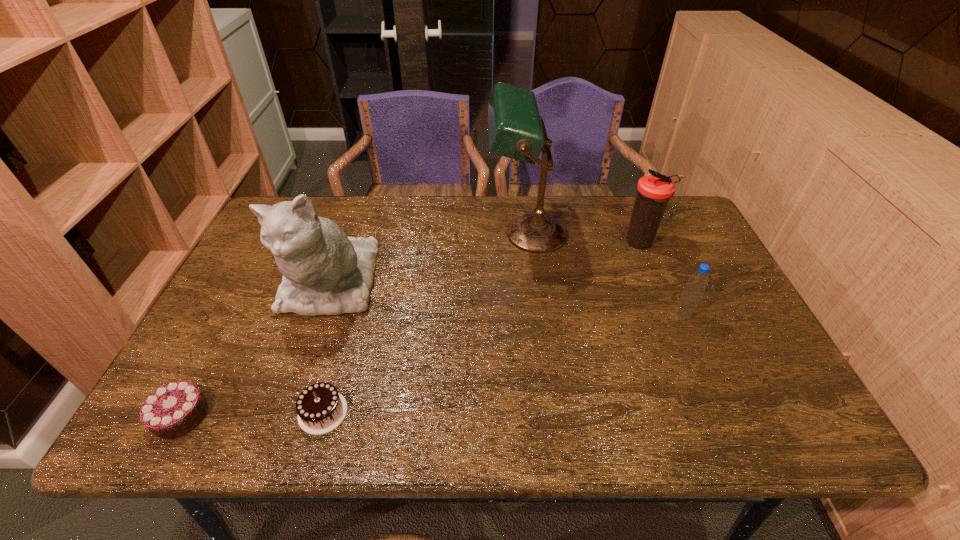
I want to click on free region located 0.060m on the front-facing side of the fifth shortest object, so click(306, 353).

This screenshot has height=540, width=960. In order to click on vacant area situated on the back of the thermos bottle in this screenshot , I will do coord(621,197).

The height and width of the screenshot is (540, 960). I want to click on vacant area located on the back of the water bottle, so click(x=646, y=231).

This screenshot has width=960, height=540. I want to click on vacant space located 0.110m on the back of the right chocolate cake, so click(341, 350).

In order to click on vacant space located 0.100m on the back of the left chocolate cake in this screenshot , I will do `click(213, 354)`.

In order to click on table lamp situated at the far edge in this screenshot , I will do `click(516, 130)`.

Find the location of a particular element. The height and width of the screenshot is (540, 960). cat that is at the far edge is located at coordinates pyautogui.click(x=325, y=272).

The height and width of the screenshot is (540, 960). What are the coordinates of `thermos bottle that is at the far edge` in the screenshot? It's located at (653, 191).

The image size is (960, 540). I want to click on cat present at the left edge, so click(325, 272).

Identify the location of chocolate cake positioned at the left edge. This screenshot has height=540, width=960. (173, 410).